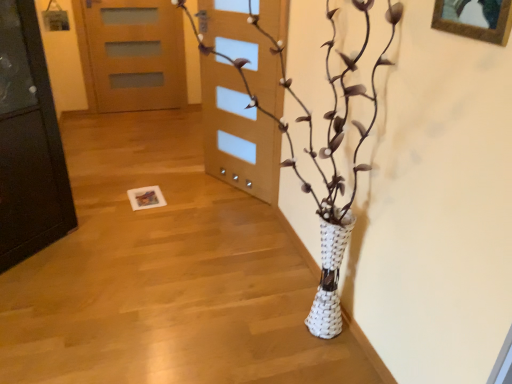
Question: Are white woven vase at center and wooden picture frame at upper right beside each other?

Choices:
 (A) yes
 (B) no

Answer: (B)

Question: Is white woven vase at center at the left side of wooden picture frame at upper right?

Choices:
 (A) no
 (B) yes

Answer: (B)

Question: Considering the relative sizes of white woven vase at center and wooden picture frame at upper right in the image provided, is white woven vase at center taller than wooden picture frame at upper right?

Choices:
 (A) no
 (B) yes

Answer: (B)

Question: Considering the relative positions of white woven vase at center and wooden picture frame at upper right in the image provided, is white woven vase at center in front of wooden picture frame at upper right?

Choices:
 (A) yes
 (B) no

Answer: (A)

Question: Is white woven vase at center facing towards wooden picture frame at upper right?

Choices:
 (A) yes
 (B) no

Answer: (B)

Question: Is wooden picture frame at upper right inside or outside of white woven vase at center?

Choices:
 (A) outside
 (B) inside

Answer: (B)

Question: Considering the positions of wooden picture frame at upper right and white woven vase at center in the image, is wooden picture frame at upper right bigger or smaller than white woven vase at center?

Choices:
 (A) small
 (B) big

Answer: (A)

Question: From a real-world perspective, is wooden picture frame at upper right above or below white woven vase at center?

Choices:
 (A) below
 (B) above

Answer: (B)

Question: In terms of height, does wooden picture frame at upper right look taller or shorter compared to white woven vase at center?

Choices:
 (A) short
 (B) tall

Answer: (A)

Question: From a real-world perspective, relative to wooden door at upper center, is white woven vase at center vertically above or below?

Choices:
 (A) above
 (B) below

Answer: (A)

Question: From the image's perspective, is white woven vase at center located above or below wooden door at upper center?

Choices:
 (A) above
 (B) below

Answer: (B)

Question: Is white woven vase at center taller or shorter than wooden door at upper center?

Choices:
 (A) tall
 (B) short

Answer: (A)

Question: Considering the positions of white woven vase at center and wooden door at upper center in the image, is white woven vase at center wider or thinner than wooden door at upper center?

Choices:
 (A) wide
 (B) thin

Answer: (A)

Question: Visually, is wooden picture frame at upper right positioned to the left or to the right of wooden door at upper center?

Choices:
 (A) right
 (B) left

Answer: (A)

Question: From the image's perspective, is wooden picture frame at upper right positioned above or below wooden door at upper center?

Choices:
 (A) below
 (B) above

Answer: (A)